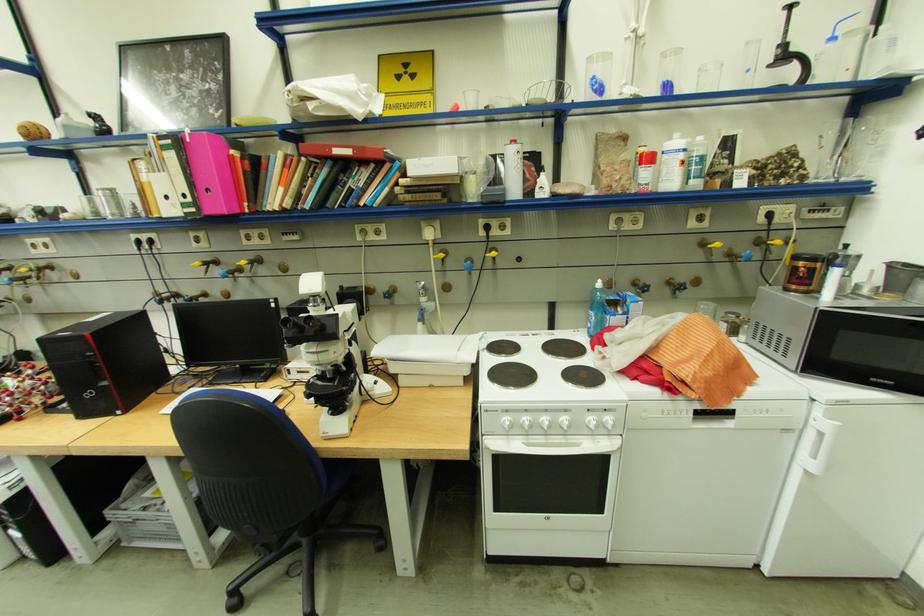
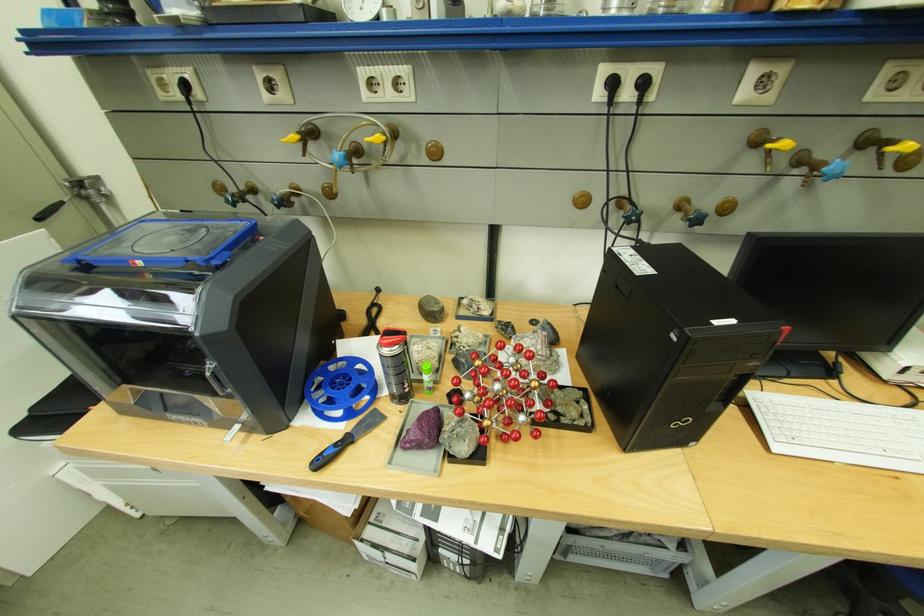
Where in the second image is the point corresponding to (x=156, y=246) from the first image?

(638, 95)